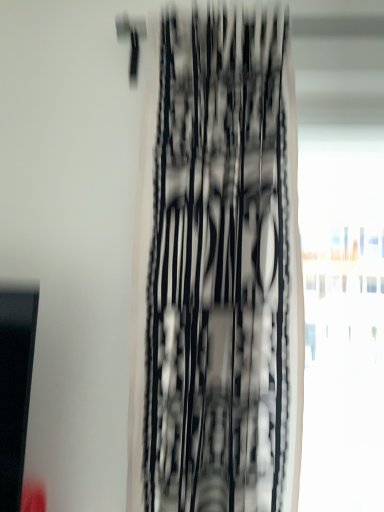
What do you see at coordinates (217, 272) in the screenshot? I see `black mesh curtain at center` at bounding box center [217, 272].

You are a GUI agent. You are given a task and a screenshot of the screen. Output one action in this format:
    pyautogui.click(x=<x>, y=<y>)
    Task: Click on the black mesh curtain at center
    The width and height of the screenshot is (384, 512).
    Given the screenshot: What is the action you would take?
    pyautogui.click(x=217, y=272)

What do you see at coordinates (342, 317) in the screenshot? The width and height of the screenshot is (384, 512). I see `transparent glass window at right` at bounding box center [342, 317].

Identify the location of transparent glass window at right. (342, 317).

The image size is (384, 512). Identify the location of black mesh curtain at center. tap(217, 272).

Is transparent glass window at right at the left side of black mesh curtain at center?

No, transparent glass window at right is not to the left of black mesh curtain at center.

Considering the positions of objects transparent glass window at right and black mesh curtain at center in the image provided, who is in front, transparent glass window at right or black mesh curtain at center?

Positioned in front is black mesh curtain at center.

Which is farther, (313,290) or (137,414)?

Positioned behind is point (313,290).

From the image's perspective, is transparent glass window at right below black mesh curtain at center?

Yes, from the image's perspective, transparent glass window at right is below black mesh curtain at center.

From a real-world perspective, which object stands above the other?

black mesh curtain at center, from a real-world perspective.

Is transparent glass window at right wider or thinner than black mesh curtain at center?

Clearly, transparent glass window at right has less width compared to black mesh curtain at center.

Which of these two, transparent glass window at right or black mesh curtain at center, stands taller?

With more height is black mesh curtain at center.

Which of these two, transparent glass window at right or black mesh curtain at center, is smaller?

transparent glass window at right.

Is transparent glass window at right not inside black mesh curtain at center?

Yes, transparent glass window at right is not within black mesh curtain at center.

Is transparent glass window at right not close to black mesh curtain at center?

transparent glass window at right is positioned a significant distance from black mesh curtain at center.

Could you tell me if transparent glass window at right is facing black mesh curtain at center?

No, transparent glass window at right is not aimed at black mesh curtain at center.

How many degrees apart are the facing directions of transparent glass window at right and black mesh curtain at center?

There is a 0.000177-degree angle between the facing directions of transparent glass window at right and black mesh curtain at center.

Locate an element on the screen. The height and width of the screenshot is (512, 384). window to the right of black mesh curtain at center is located at coordinates (342, 317).

Considering the relative positions of black mesh curtain at center and transparent glass window at right in the image provided, is black mesh curtain at center to the left of transparent glass window at right from the viewer's perspective?

Indeed, black mesh curtain at center is positioned on the left side of transparent glass window at right.

Looking at this image, between black mesh curtain at center and transparent glass window at right, which one is positioned behind?

transparent glass window at right is behind.

Considering the points (153, 307) and (382, 500), which point is in front, point (153, 307) or point (382, 500)?

The point (153, 307) is in front.

From the image's perspective, who appears lower, black mesh curtain at center or transparent glass window at right?

transparent glass window at right, from the image's perspective.

From a real-world perspective, between black mesh curtain at center and transparent glass window at right, who is vertically higher?

black mesh curtain at center.

Considering the relative sizes of black mesh curtain at center and transparent glass window at right in the image provided, is black mesh curtain at center thinner than transparent glass window at right?

Incorrect, the width of black mesh curtain at center is not less than that of transparent glass window at right.

Is black mesh curtain at center taller or shorter than transparent glass window at right?

Considering their sizes, black mesh curtain at center has more height than transparent glass window at right.

In terms of size, does black mesh curtain at center appear bigger or smaller than transparent glass window at right?

black mesh curtain at center is bigger than transparent glass window at right.

Which is correct: black mesh curtain at center is inside transparent glass window at right, or outside of it?

black mesh curtain at center cannot be found inside transparent glass window at right.

Is black mesh curtain at center not close to transparent glass window at right?

That's right, there is a large distance between black mesh curtain at center and transparent glass window at right.

Is transparent glass window at right at the back of black mesh curtain at center?

No, black mesh curtain at center's orientation is not away from transparent glass window at right.

Measure the distance from black mesh curtain at center to transparent glass window at right.

They are 5.78 feet apart.

Find the location of `window behind the black mesh curtain at center`. window behind the black mesh curtain at center is located at coordinates click(342, 317).

Image resolution: width=384 pixels, height=512 pixels. In order to click on curtain above the transparent glass window at right (from a real-world perspective) in this screenshot , I will do point(217,272).

Where is `window below the black mesh curtain at center (from a real-world perspective)`? This screenshot has width=384, height=512. window below the black mesh curtain at center (from a real-world perspective) is located at coordinates coord(342,317).